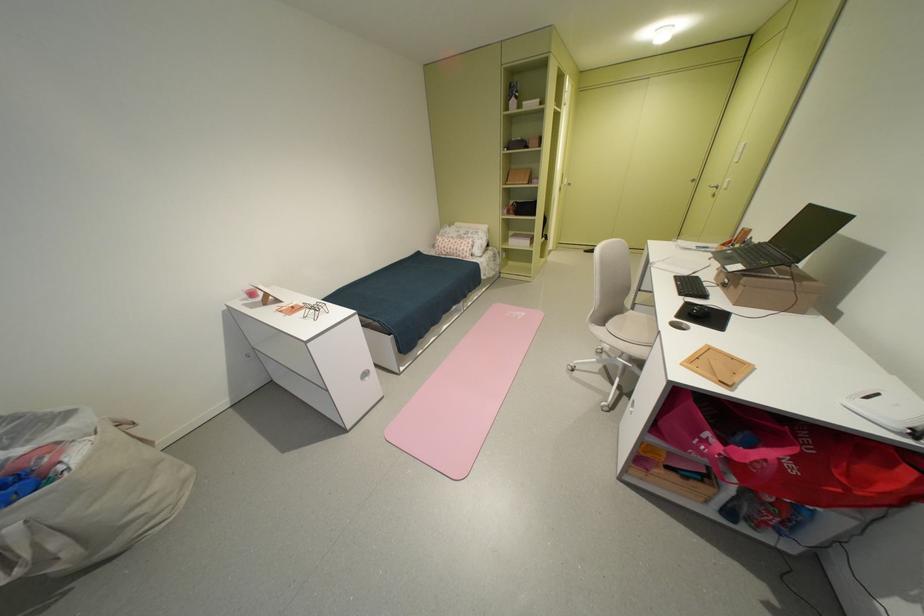
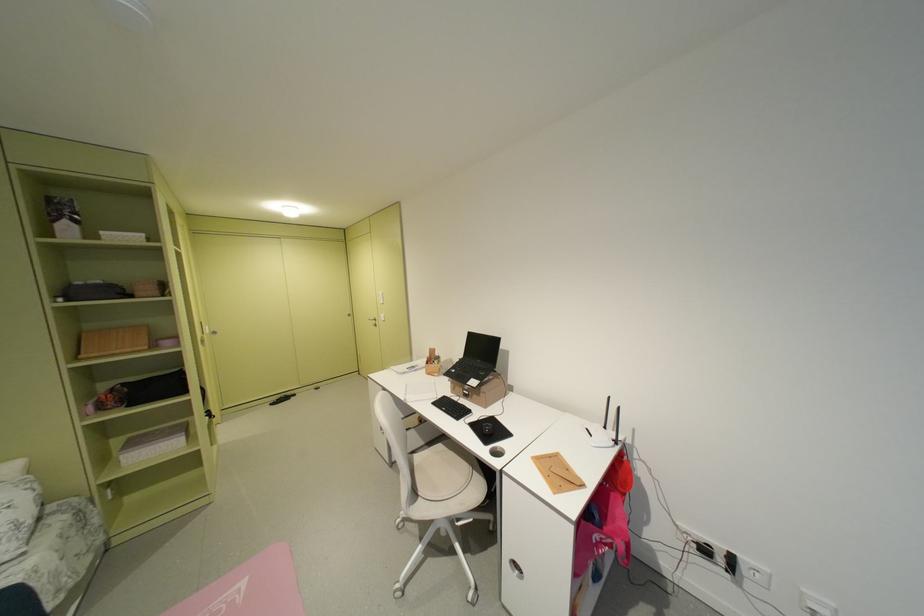
Question: The camera is either moving clockwise (left) or counter-clockwise (right) around the object. The first image is from the beginning of the video and the second image is from the end. Is the camera moving left or right when shooting the video?

Choices:
 (A) Left
 (B) Right

Answer: (A)